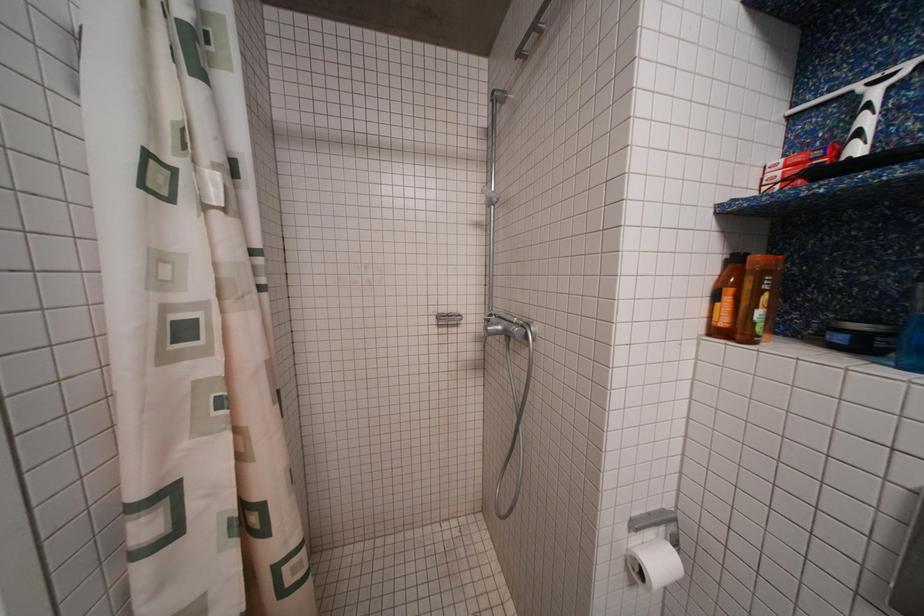
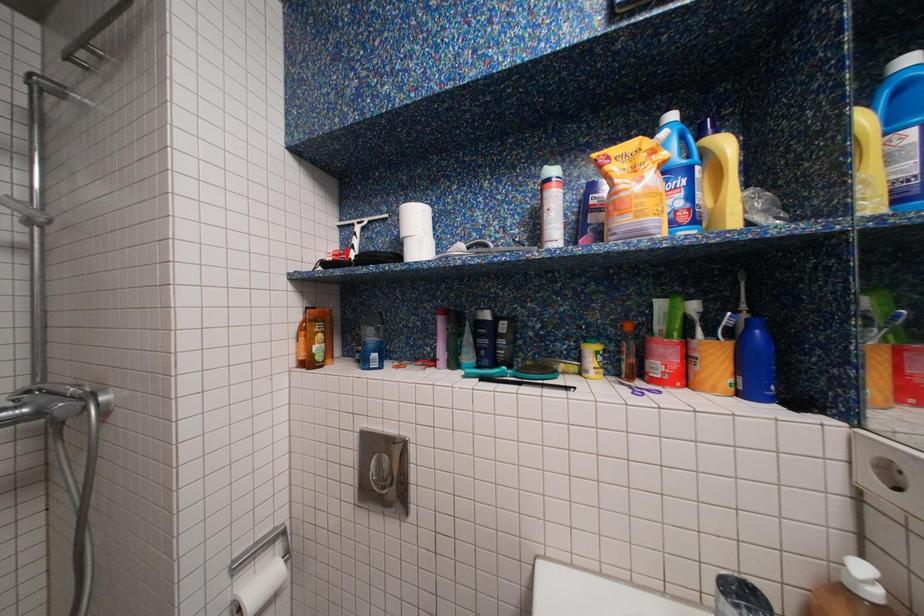
Question: The camera is either moving clockwise (left) or counter-clockwise (right) around the object. The first image is from the beginning of the video and the second image is from the end. Is the camera moving left or right when shooting the video?

Choices:
 (A) Left
 (B) Right

Answer: (A)